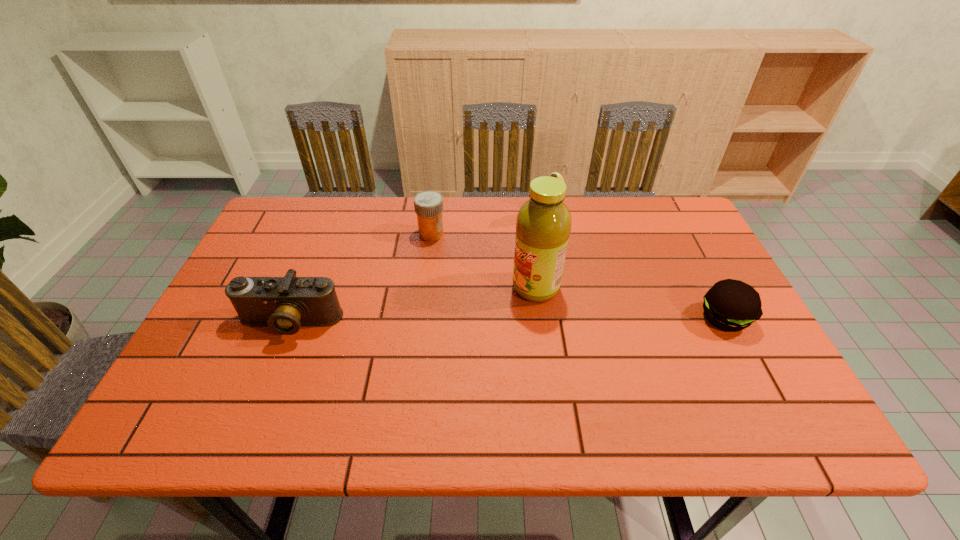
This screenshot has width=960, height=540. Find the location of `free space that is in between the tallest object and the leftmost object`. free space that is in between the tallest object and the leftmost object is located at coordinates (413, 305).

The image size is (960, 540). In order to click on vacant space in between the tallest object and the camera in this screenshot , I will do point(413,305).

Locate an element on the screen. The height and width of the screenshot is (540, 960). free space between the fruit juice and the medicine is located at coordinates (484, 260).

You are a GUI agent. You are given a task and a screenshot of the screen. Output one action in this format:
    pyautogui.click(x=<x>, y=<y>)
    Task: Click on the vacant space in between the tallest object and the medicine
    
    Given the screenshot: What is the action you would take?
    pyautogui.click(x=484, y=260)

Find the location of a particular element. The height and width of the screenshot is (540, 960). vacant region between the fruit juice and the rightmost object is located at coordinates (630, 303).

Image resolution: width=960 pixels, height=540 pixels. Identify the location of free space between the fourth object from right to left and the fruit juice. (484, 260).

Where is `vacant point located between the fruit juice and the leftmost object`? This screenshot has width=960, height=540. vacant point located between the fruit juice and the leftmost object is located at coordinates (413, 305).

I want to click on object that ranks as the third closest to the camera, so click(554, 174).

Locate which object is the fourth closest to the banana. Please provide its 2D coordinates. Your answer should be formatted as a tuple, i.e. [(x, y)], where the tuple contains the x and y coordinates of a point satisfying the conditions above.

[(284, 304)]

Image resolution: width=960 pixels, height=540 pixels. I want to click on free space in the image that satisfies the following two spatial constraints: 1. on the front side of the shortest object; 2. on the right side of the second object from left to right, so click(x=420, y=318).